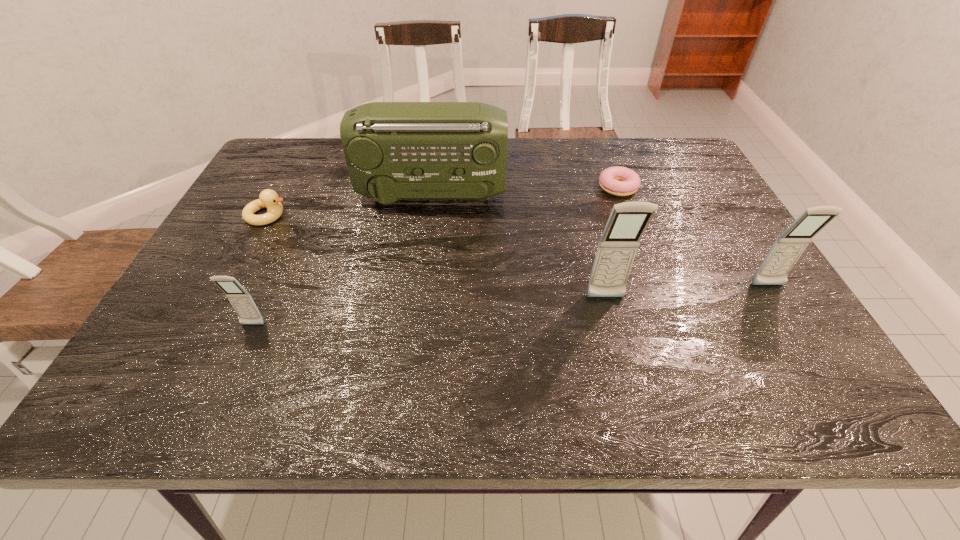
The image size is (960, 540). I want to click on cellular telephone located in the left edge section of the desktop, so click(x=242, y=302).

At what (x,y) coordinates should I click in order to perform the action: click on duckling that is at the left edge. Please return your answer as a coordinate pair (x, y). Image resolution: width=960 pixels, height=540 pixels. Looking at the image, I should click on (x=268, y=198).

Where is `object located in the right edge section of the desktop`? This screenshot has height=540, width=960. object located in the right edge section of the desktop is located at coordinates (789, 246).

At what (x,y) coordinates should I click in order to perform the action: click on object at the near left corner. Please return your answer as a coordinate pair (x, y). Looking at the image, I should click on (242, 302).

This screenshot has width=960, height=540. In the image, there is a desktop. In order to click on vacant space at the far edge in this screenshot , I will do `click(591, 138)`.

In the image, there is a desktop. Where is `free space at the near edge`? The image size is (960, 540). free space at the near edge is located at coordinates (600, 345).

Locate an element on the screen. This screenshot has width=960, height=540. vacant space at the left edge of the desktop is located at coordinates (211, 261).

In the image, there is a desktop. Identify the location of free space at the right edge. (725, 252).

Locate an element on the screen. Image resolution: width=960 pixels, height=540 pixels. vacant space at the far right corner of the desktop is located at coordinates (655, 180).

Find the location of `vacant space at the near right corner of the desktop`. vacant space at the near right corner of the desktop is located at coordinates (821, 360).